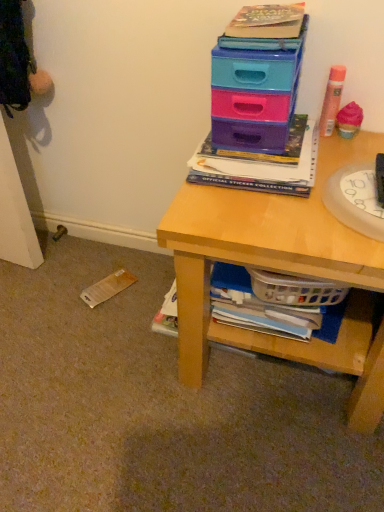
Identify the location of blank space above transparent plastic plate at right (from a real-world perspective). Image resolution: width=384 pixels, height=512 pixels. (360, 188).